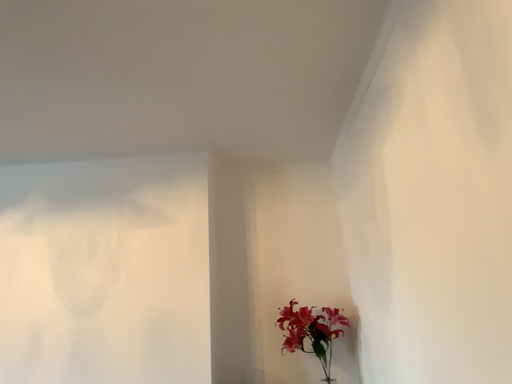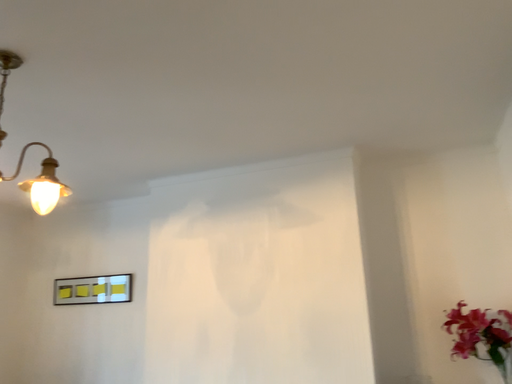
Question: How did the camera likely rotate when shooting the video?

Choices:
 (A) rotated left
 (B) rotated right

Answer: (A)